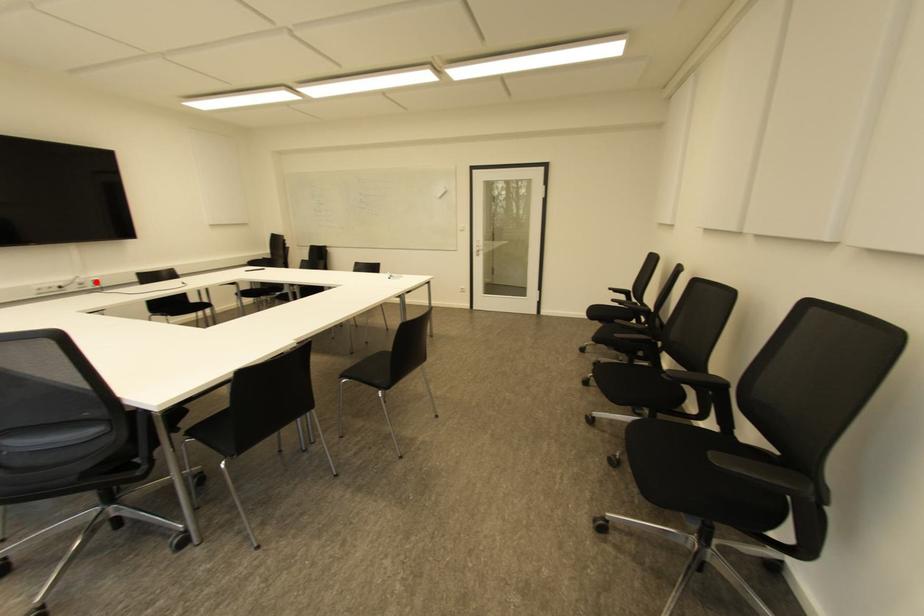
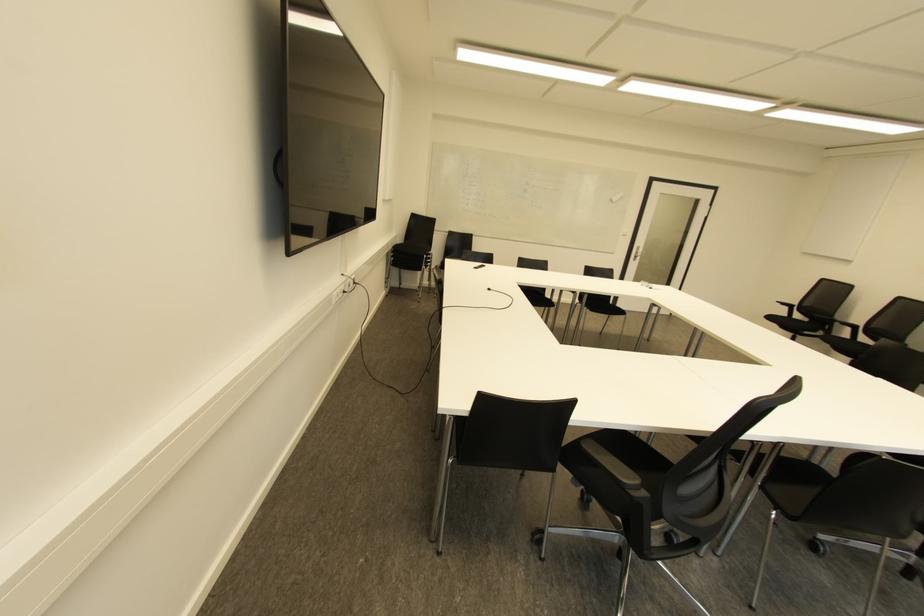
Question: I am providing you with two images of the same scene from different viewpoints. Image1 has a red point marked. In image2, the corresponding 3D location appears at what relative position? Reply with the corresponding letter.

Choices:
 (A) Closer
 (B) Farther

Answer: (A)